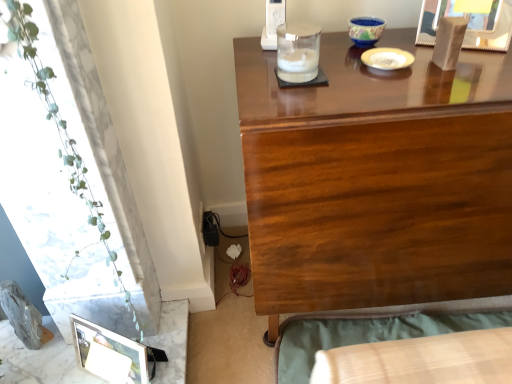
This screenshot has height=384, width=512. Identify the location of vacant area that is situated to the right of white glossy plate at upper center. (459, 53).